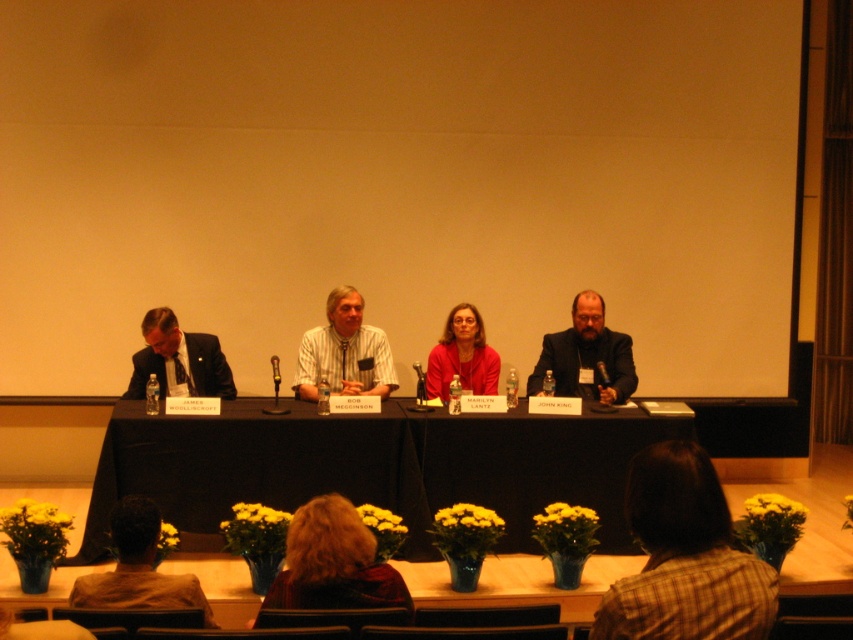
Who is shorter, dark brown hair at lower center or matte black suit at left?

dark brown hair at lower center is shorter.

Consider the image. Is dark brown hair at lower center positioned behind matte black suit at left?

No, it is not.

Where is `dark brown hair at lower center`? dark brown hair at lower center is located at coordinates (334, 563).

Consider the image. Does brown leather jacket at lower left appear on the right side of matte red blouse at center?

No, brown leather jacket at lower left is not to the right of matte red blouse at center.

How much distance is there between brown leather jacket at lower left and matte red blouse at center?

brown leather jacket at lower left and matte red blouse at center are 9.17 feet apart from each other.

Is point (106, 605) farther from viewer compared to point (454, 336)?

No.

Find the location of a particular element. brown leather jacket at lower left is located at coordinates (138, 568).

Does striped cotton shirt at center appear under matte black suit at left?

No, striped cotton shirt at center is not below matte black suit at left.

Does striped cotton shirt at center have a smaller size compared to matte black suit at left?

No, striped cotton shirt at center is not smaller than matte black suit at left.

Does point (302, 364) come in front of point (144, 376)?

That is False.

Locate an element on the screen. The height and width of the screenshot is (640, 853). striped cotton shirt at center is located at coordinates (343, 352).